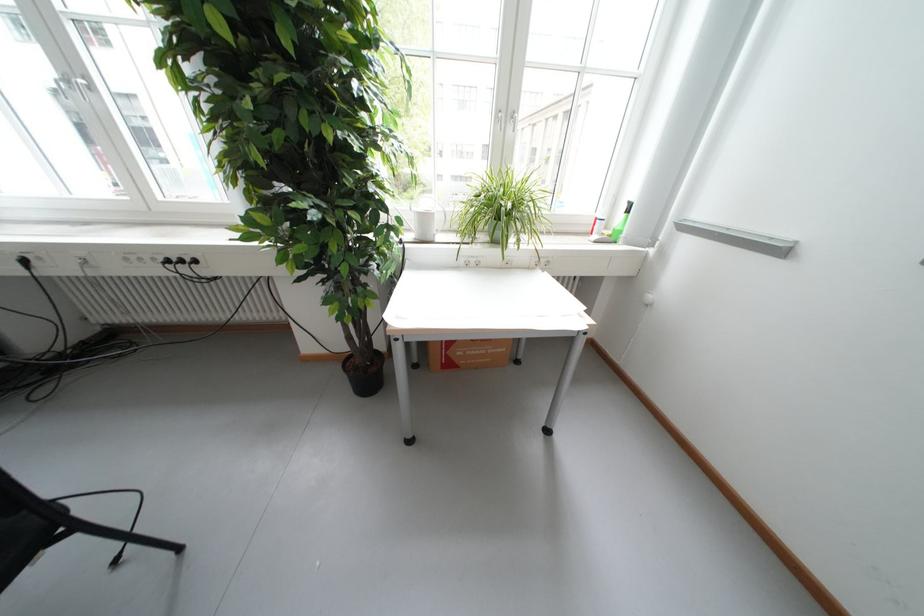
Where would you lift the white watering can handle? Please return your answer as a coordinate pair (x, y).

(423, 223)